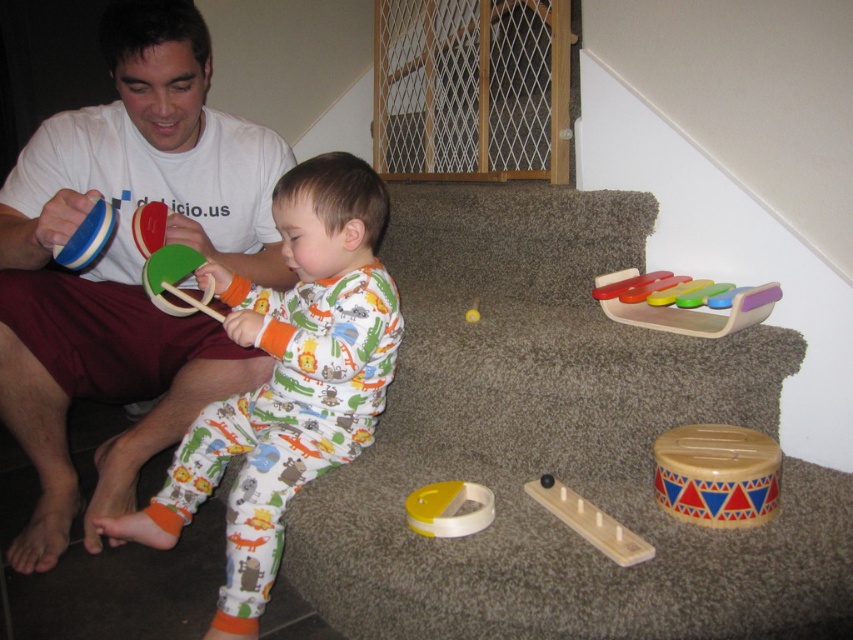
Question: Which point is closer to the camera?

Choices:
 (A) (469, 321)
 (B) (190, 262)
 (C) (631, 536)

Answer: (C)

Question: Which is farther from the matte green ring at center?

Choices:
 (A) yellow matte ball at center
 (B) wooden pegboard at center

Answer: (B)

Question: Does wooden pegboard at center lie behind yellow matte ring at center?

Choices:
 (A) no
 (B) yes

Answer: (A)

Question: Based on their relative distances, which object is farther from the yellow matte ball at center?

Choices:
 (A) matte green wooden toy at center
 (B) wooden drum at lower right

Answer: (B)

Question: Does white cotton shirt at upper left appear over yellow matte ball at center?

Choices:
 (A) no
 (B) yes

Answer: (B)

Question: Can you confirm if wooden drum at lower right is positioned to the right of wooden pegboard at center?

Choices:
 (A) no
 (B) yes

Answer: (B)